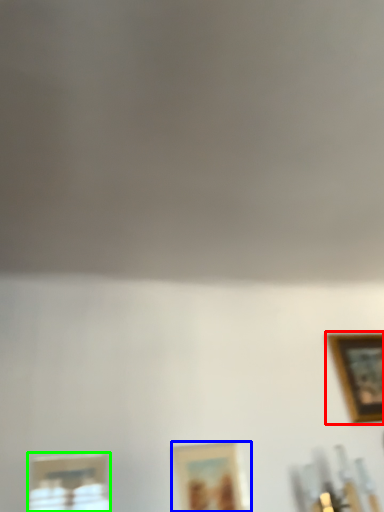
Question: Which is farther away from picture frame (highlighted by a red box)? picture frame (highlighted by a blue box) or picture frame (highlighted by a green box)?

Choices:
 (A) picture frame
 (B) picture frame

Answer: (B)